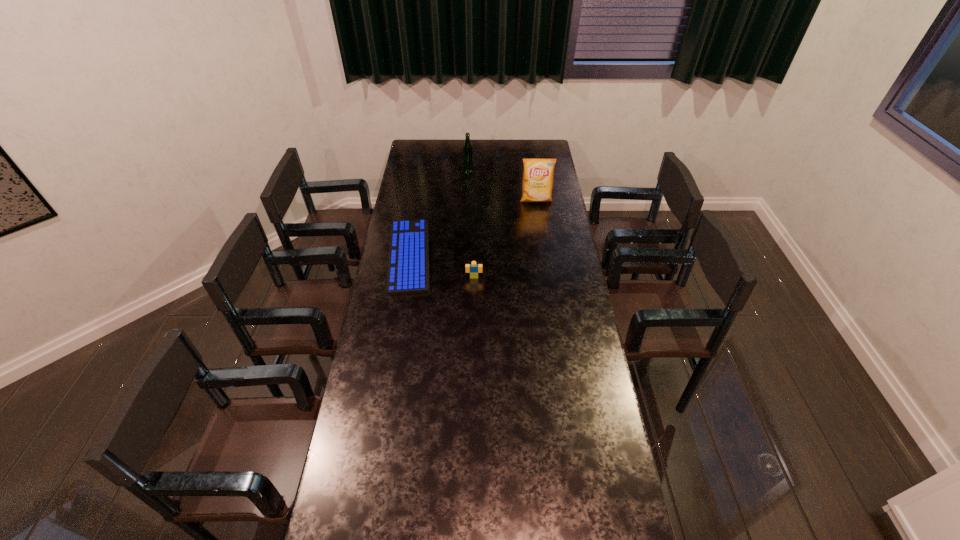
The image size is (960, 540). In order to click on crisp (potato chip) in this screenshot , I will do `click(538, 175)`.

Find the location of `the third nearest object`. the third nearest object is located at coordinates (538, 175).

Where is `beer bottle`? This screenshot has height=540, width=960. beer bottle is located at coordinates (467, 148).

Find the location of a particular element. Image resolution: width=960 pixels, height=540 pixels. the second shortest object is located at coordinates (473, 268).

Where is `computer keyboard`? This screenshot has width=960, height=540. computer keyboard is located at coordinates (408, 271).

At what (x,y) coordinates should I click in order to perform the action: click on the shortest object. Please return your answer as a coordinate pair (x, y). The height and width of the screenshot is (540, 960). Looking at the image, I should click on (408, 271).

What are the coordinates of `vacant space located 0.240m on the front-facing side of the second farthest object` in the screenshot? It's located at (541, 235).

Find the location of a particular element. The image size is (960, 540). vacant space situated on the right of the farthest object is located at coordinates click(x=512, y=166).

Find the location of `vacant position located on the face of the Lego`. vacant position located on the face of the Lego is located at coordinates (473, 308).

Locate an element on the screen. The image size is (960, 540). vacant space located on the front of the computer keyboard is located at coordinates (396, 341).